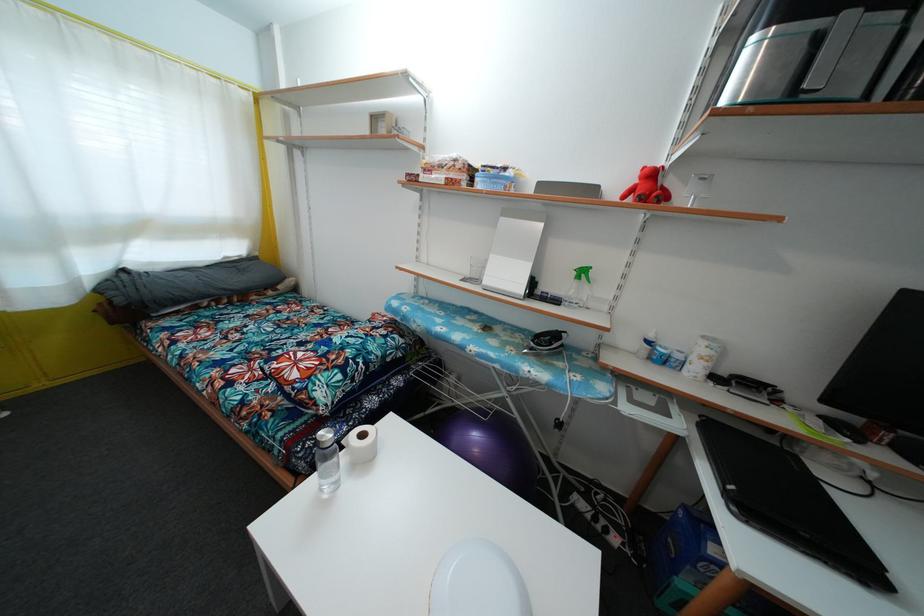
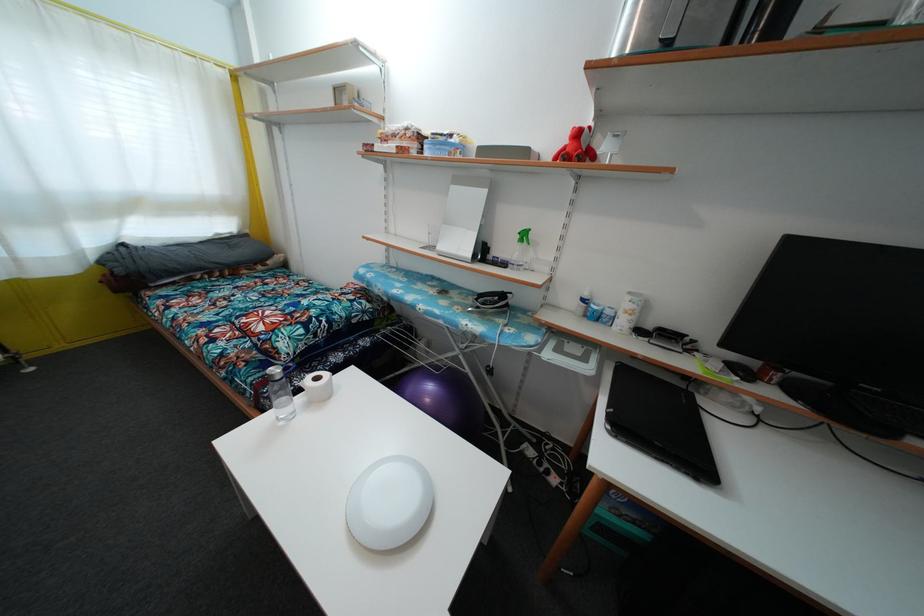
In the second image, find the point that corresponds to [480,458] in the first image.

(431, 407)